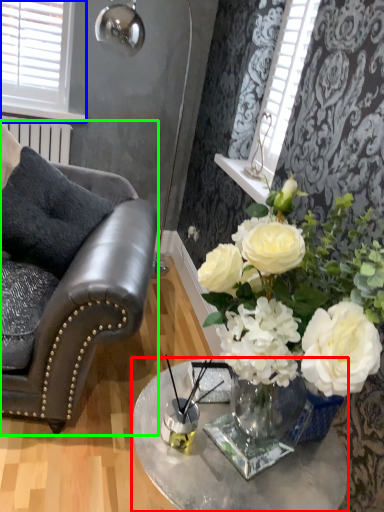
Question: Considering the real-world distances, which object is closest to table (highlighted by a red box)? window (highlighted by a blue box) or chair (highlighted by a green box).

Choices:
 (A) window
 (B) chair

Answer: (B)